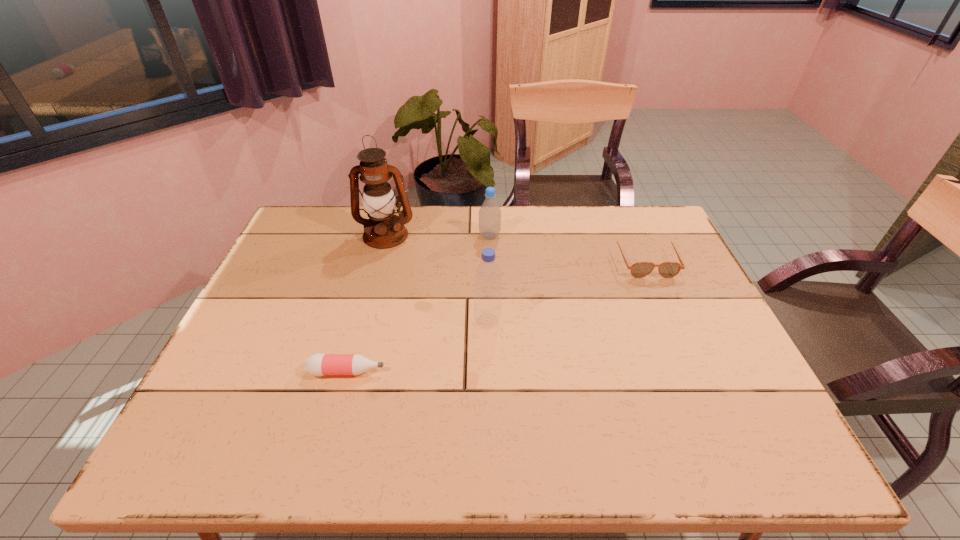
Find the location of a particular element. The width and height of the screenshot is (960, 540). lantern is located at coordinates (383, 230).

Image resolution: width=960 pixels, height=540 pixels. Find the location of `the fourth shortest object`. the fourth shortest object is located at coordinates (488, 276).

The height and width of the screenshot is (540, 960). Find the location of `the second farthest bottle`. the second farthest bottle is located at coordinates (488, 276).

Where is `the third tallest object`? the third tallest object is located at coordinates (490, 213).

Find the location of `the farthest bottle`. the farthest bottle is located at coordinates (490, 213).

At what (x,y) coordinates should I click in order to perform the action: click on sunglasses. Please return your answer as a coordinate pair (x, y). Looking at the image, I should click on (641, 269).

Locate an element on the screen. The width and height of the screenshot is (960, 540). the nearest object is located at coordinates (319, 364).

The height and width of the screenshot is (540, 960). Identify the location of the shortest bottle. (319, 364).

You are a GUI agent. You are given a task and a screenshot of the screen. Output one action in this format:
    pyautogui.click(x=<x>, y=<y>)
    Task: Click on the vacant area situated 0.370m on the side of the lantern, there is a wick adjustment knob
    
    Given the screenshot: What is the action you would take?
    pos(357,342)

The image size is (960, 540). In order to click on blank space located on the right of the tallest bottle in this screenshot , I will do `click(644, 321)`.